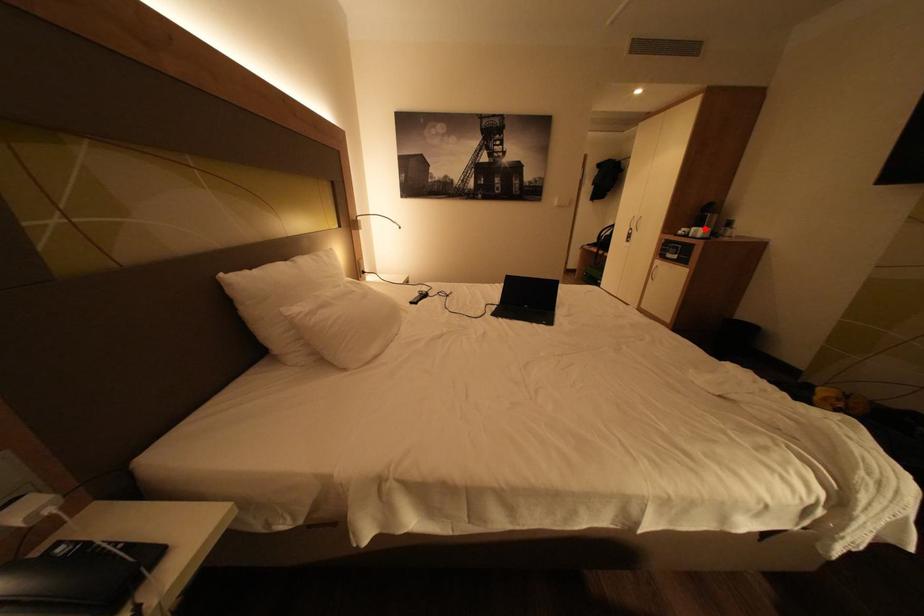
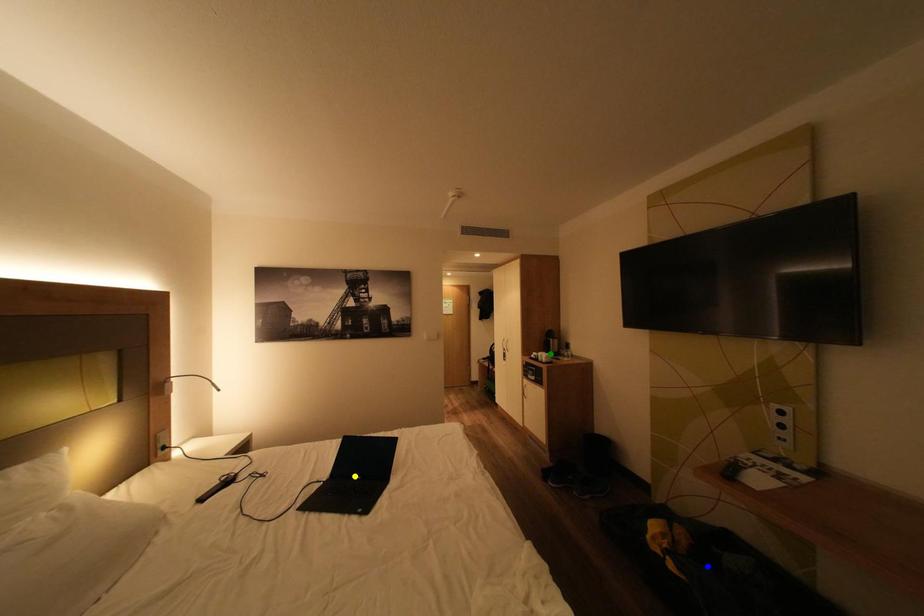
Question: I am providing you with two images of the same scene from different viewpoints. A red point is marked on the first image. You are given multiple points on the second image. Can you choose the point in image 2 that corresponds to the point in image 1?

Choices:
 (A) yellow point
 (B) green point
 (C) blue point

Answer: (B)